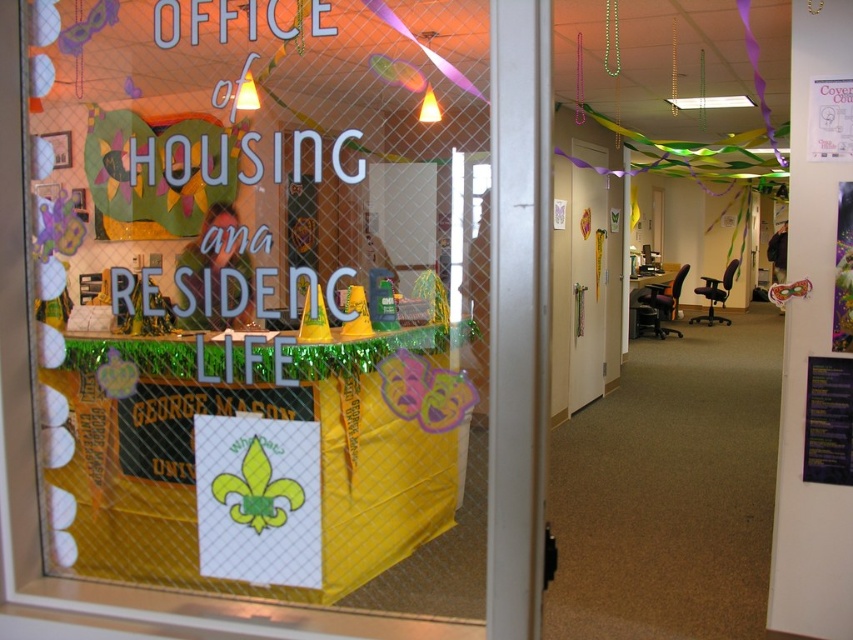
You are a visitor at George Mason University and need to enter the Office of Housing and Residence Life. You see the yellow fabric at center and the white glossy door at center. Which object is closer to the floor?

The yellow fabric at center is below white glossy door at center, so the yellow fabric at center is closer to the floor.

You are an office worker who needs to hang a large poster. You have two options for placement in the entrance area. The yellow fabric at center and the white glossy door at center. Which surface can accommodate a larger poster?

The yellow fabric at center is bigger than the white glossy door at center, so the yellow fabric at center can accommodate a larger poster.